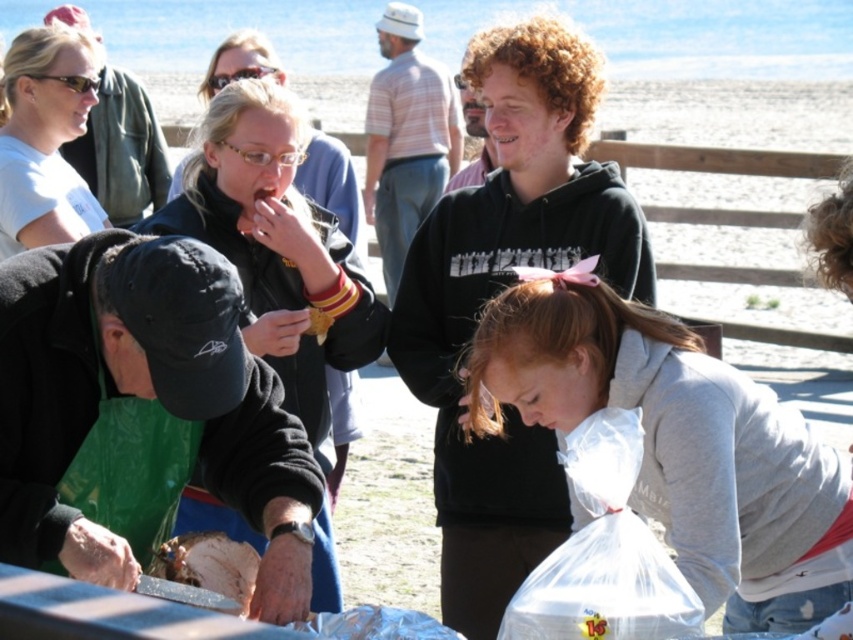
Which is in front, point (654, 513) or point (303, 381)?

Positioned in front is point (654, 513).

Does gray matte plastic bag at lower center have a lesser height compared to matte black jacket at center?

Correct, gray matte plastic bag at lower center is not as tall as matte black jacket at center.

Locate an element on the screen. This screenshot has width=853, height=640. gray matte plastic bag at lower center is located at coordinates (677, 442).

Which of these two, gray matte plastic bag at lower center or black hoodie at upper center, stands shorter?

Standing shorter between the two is gray matte plastic bag at lower center.

Who is lower down, gray matte plastic bag at lower center or black hoodie at upper center?

gray matte plastic bag at lower center

Locate an element on the screen. The width and height of the screenshot is (853, 640). gray matte plastic bag at lower center is located at coordinates (677, 442).

Between gray matte plastic bag at lower center and white matte t-shirt at upper left, which one appears on the left side from the viewer's perspective?

From the viewer's perspective, white matte t-shirt at upper left appears more on the left side.

Measure the distance between gray matte plastic bag at lower center and camera.

They are 3.73 meters apart.

You are a GUI agent. You are given a task and a screenshot of the screen. Output one action in this format:
    pyautogui.click(x=<x>, y=<y>)
    Task: Click on the gray matte plastic bag at lower center
    The height and width of the screenshot is (640, 853).
    Given the screenshot: What is the action you would take?
    pyautogui.click(x=677, y=442)